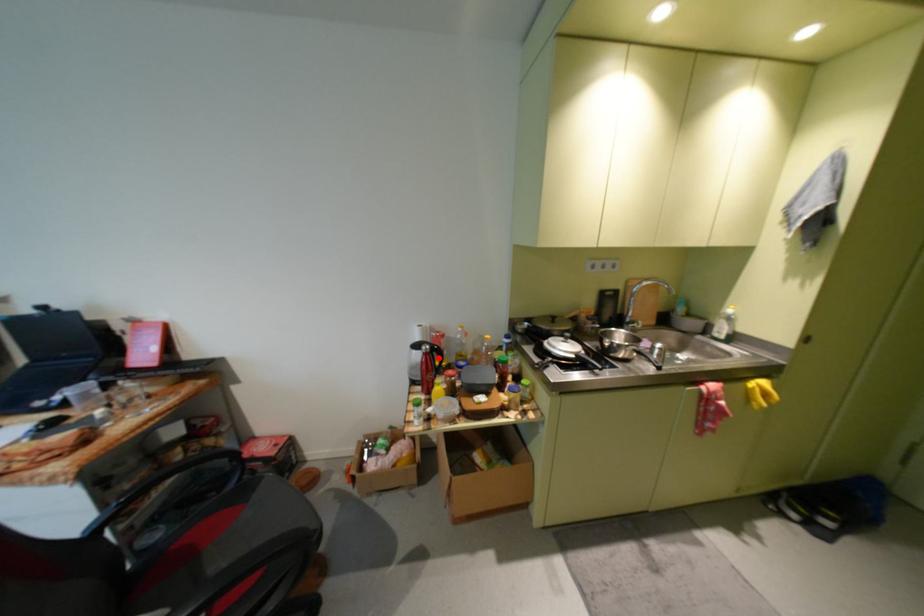
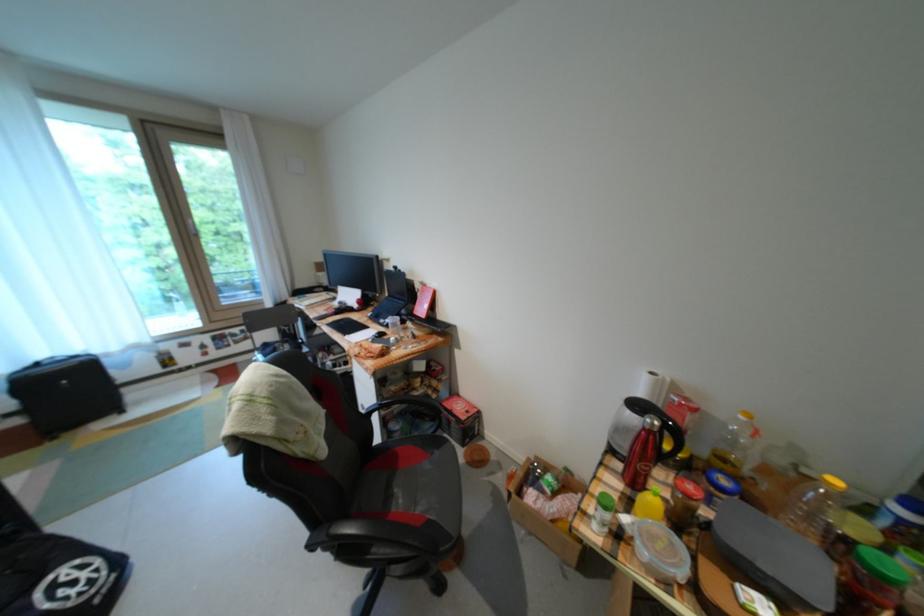
Find the pixel in the second image that matches the highlighted location in the first image.

(662, 438)